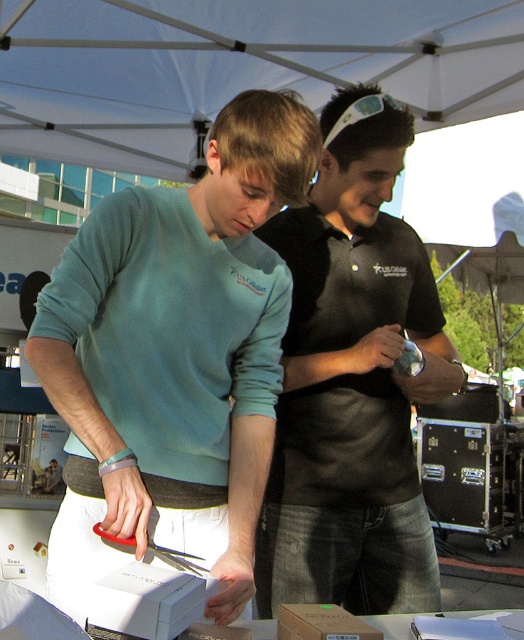
Is matte blue sweater at center positioned behind white matte box at center?

Yes.

Consider the image. Which of these two, matte blue sweater at center or white matte box at center, stands shorter?

white matte box at center

Between point (256, 445) and point (113, 604), which one is positioned behind?

Positioned behind is point (256, 445).

At what (x,y) coordinates should I click in order to perform the action: click on matte blue sweater at center. Please return your answer as a coordinate pair (x, y). The width and height of the screenshot is (524, 640). Looking at the image, I should click on (176, 353).

How much distance is there between matte blue sweater at center and brown cardboard box at lower center?

matte blue sweater at center and brown cardboard box at lower center are 19.43 inches apart.

Is matte blue sweater at center to the right of brown cardboard box at lower center from the viewer's perspective?

In fact, matte blue sweater at center is to the left of brown cardboard box at lower center.

You are a GUI agent. You are given a task and a screenshot of the screen. Output one action in this format:
    pyautogui.click(x=<x>, y=<y>)
    Task: Click on the matte blue sweater at center
    The image size is (524, 640).
    Given the screenshot: What is the action you would take?
    pyautogui.click(x=176, y=353)

Does matte blue sweater at center have a greater width compared to black matte shirt at center?

A: Indeed, matte blue sweater at center has a greater width compared to black matte shirt at center.

Who is taller, matte blue sweater at center or black matte shirt at center?

black matte shirt at center is taller.

In order to click on matte blue sweater at center in this screenshot , I will do `click(176, 353)`.